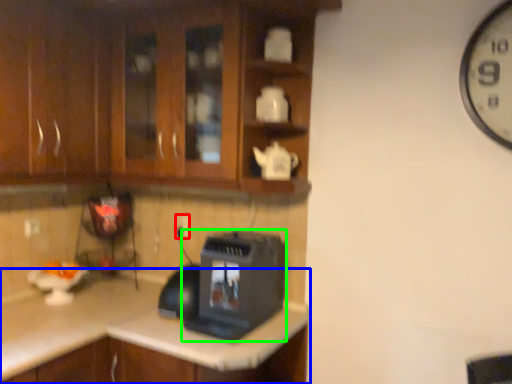
Question: Based on their relative distances, which object is farther from electric outlet (highlighted by a red box)? Choose from countertop (highlighted by a blue box) and home appliance (highlighted by a green box).

Choices:
 (A) countertop
 (B) home appliance

Answer: (A)